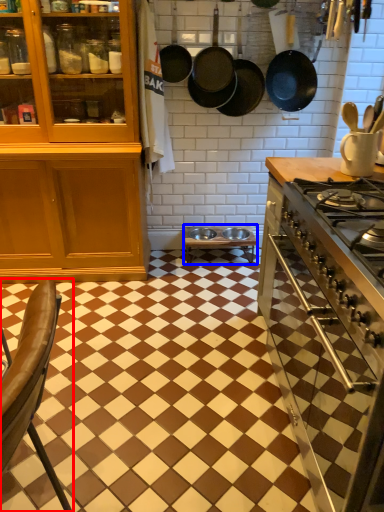
Question: Which of the following is the closest to the observer, chair (highlighted by a red box) or table (highlighted by a blue box)?

Choices:
 (A) chair
 (B) table

Answer: (A)